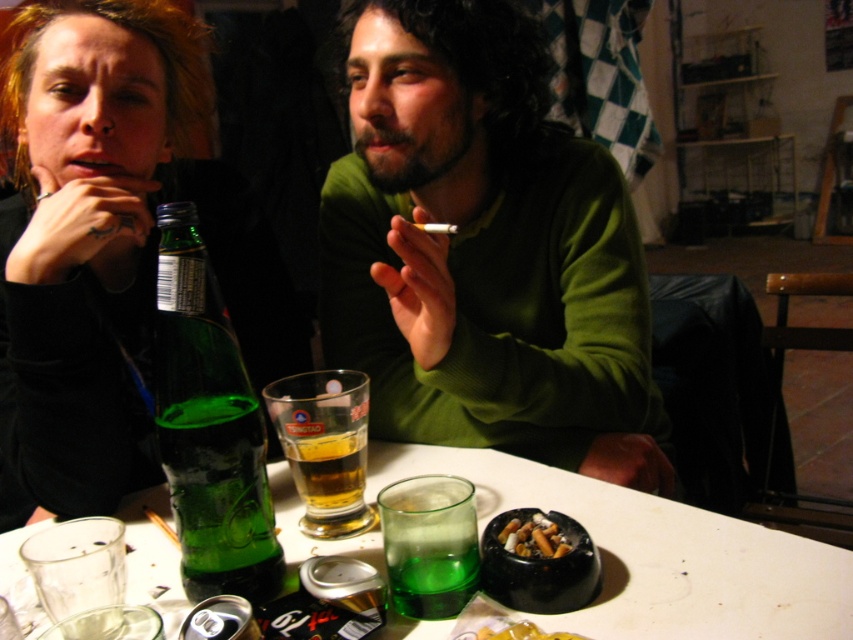
Which is below, black matte bottle at left or transparent glass ashtray at center?

transparent glass ashtray at center is lower down.

Find the location of a particular element. Image resolution: width=853 pixels, height=640 pixels. black matte bottle at left is located at coordinates (90, 189).

Find the location of a particular element. The image size is (853, 640). black matte bottle at left is located at coordinates (90, 189).

Which of these two, black matte bottle at left or charcoal ashtray at table center, stands shorter?

charcoal ashtray at table center is shorter.

Can you confirm if black matte bottle at left is positioned above charcoal ashtray at table center?

Correct, black matte bottle at left is located above charcoal ashtray at table center.

Where is `black matte bottle at left`? This screenshot has width=853, height=640. black matte bottle at left is located at coordinates (90, 189).

Image resolution: width=853 pixels, height=640 pixels. In order to click on black matte bottle at left in this screenshot , I will do `click(90, 189)`.

Which is below, green matte sweater at center or black matte bottle at left?

Positioned lower is green matte sweater at center.

Describe the element at coordinates (485, 252) in the screenshot. Image resolution: width=853 pixels, height=640 pixels. I see `green matte sweater at center` at that location.

This screenshot has height=640, width=853. Find the location of `green matte sweater at center`. green matte sweater at center is located at coordinates (485, 252).